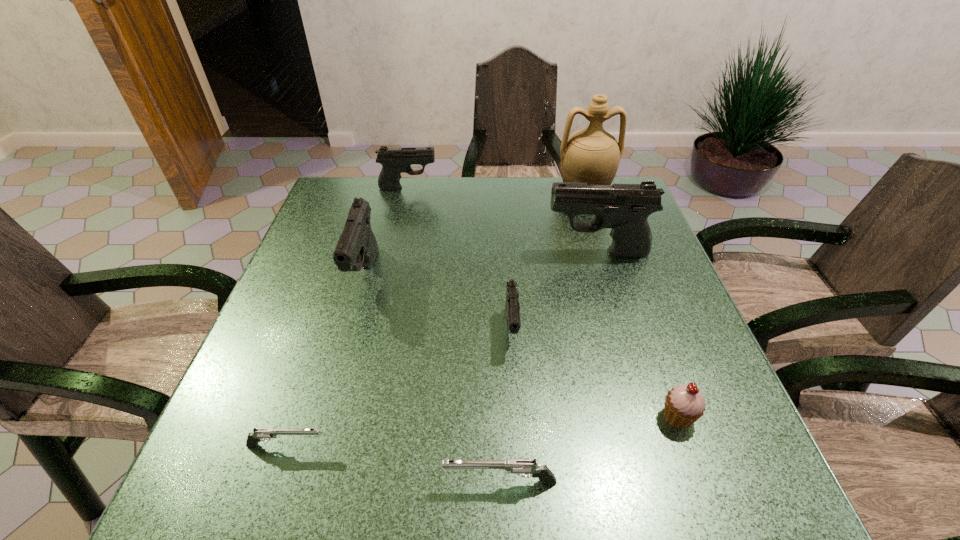
The height and width of the screenshot is (540, 960). In order to click on the tallest object in this screenshot , I will do `click(592, 155)`.

Where is `the rightmost pistol`? the rightmost pistol is located at coordinates (625, 208).

The image size is (960, 540). In order to click on the biggest black pistol in this screenshot , I will do `click(625, 208)`.

Find the location of a particular element. The width and height of the screenshot is (960, 540). the third tallest object is located at coordinates (357, 247).

Identify the location of the second biggest black pistol. (357, 247).

You are a GUI agent. You are given a task and a screenshot of the screen. Output one action in this format:
    pyautogui.click(x=<x>, y=<y>)
    Task: Click on the third tallest pistol
    Image resolution: width=960 pixels, height=540 pixels.
    Given the screenshot: What is the action you would take?
    pyautogui.click(x=394, y=161)

I want to click on the farthest pistol, so click(394, 161).

Locate an element on the screen. This screenshot has height=540, width=960. the third black pistol from left to right is located at coordinates (512, 307).

Find the location of a particular element. The height and width of the screenshot is (540, 960). the third shortest pistol is located at coordinates (512, 307).

Where is `the third nearest object`? the third nearest object is located at coordinates [685, 404].